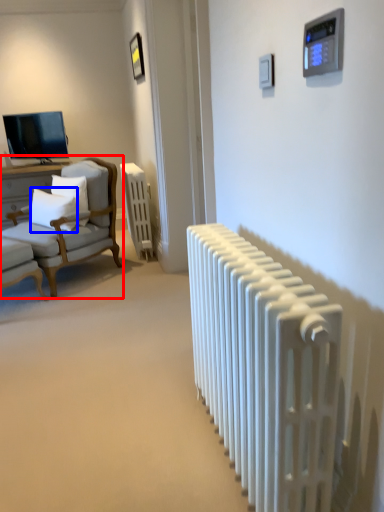
Question: Which object is further to the camera taking this photo, chair (highlighted by a red box) or pillow (highlighted by a blue box)?

Choices:
 (A) chair
 (B) pillow

Answer: (B)